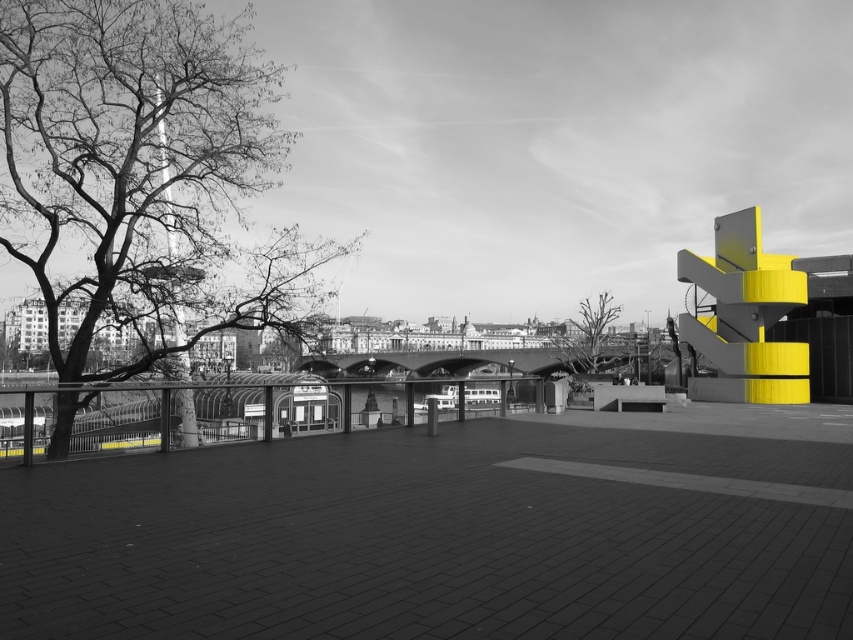
Question: Can you confirm if bare branches at left is positioned to the right of bare branches at center?

Choices:
 (A) yes
 (B) no

Answer: (B)

Question: Is bare branches at left below bare branches at center?

Choices:
 (A) yes
 (B) no

Answer: (B)

Question: Considering the relative positions of bare branches at left and bare branches at center in the image provided, where is bare branches at left located with respect to bare branches at center?

Choices:
 (A) above
 (B) below

Answer: (A)

Question: Which object appears farthest from the camera in this image?

Choices:
 (A) bare branches at left
 (B) bare branches at center

Answer: (B)

Question: Among these points, which one is farthest from the camera?

Choices:
 (A) (556, 356)
 (B) (61, 378)

Answer: (A)